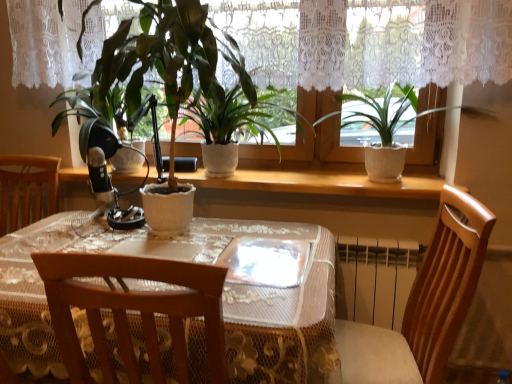
The image size is (512, 384). In order to click on free space in front of transparent plastic plate at center in this screenshot , I will do `click(269, 306)`.